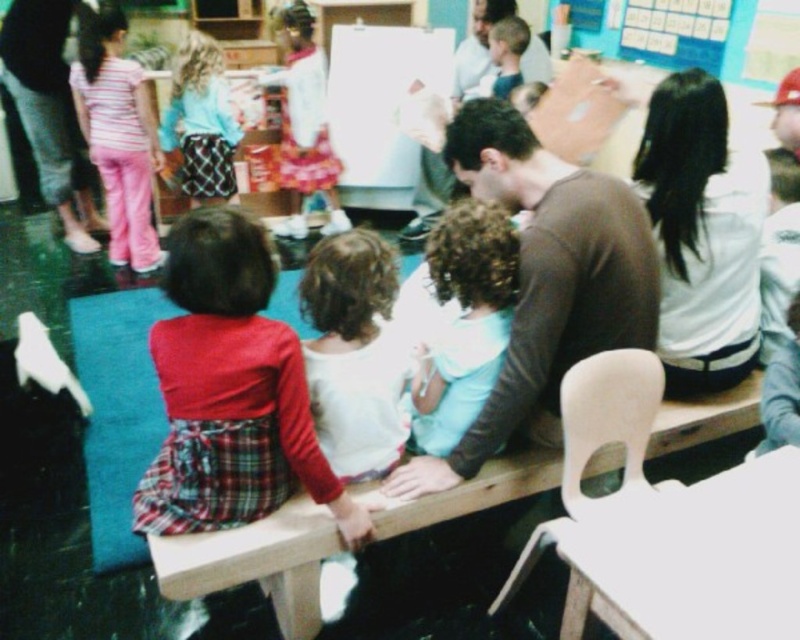
Can you confirm if brown long-sleeve shirt at center is bigger than matte pink pants at left?

No.

This screenshot has width=800, height=640. What do you see at coordinates (545, 280) in the screenshot?
I see `brown long-sleeve shirt at center` at bounding box center [545, 280].

Where is `brown long-sleeve shirt at center`? This screenshot has width=800, height=640. brown long-sleeve shirt at center is located at coordinates (545, 280).

Does matte pink pants at left appear on the right side of blue plaid skirt at center?

Incorrect, matte pink pants at left is not on the right side of blue plaid skirt at center.

Which is behind, point (84, 163) or point (198, 102)?

The point (84, 163) is more distant.

The width and height of the screenshot is (800, 640). I want to click on matte pink pants at left, so click(49, 112).

Who is lower down, white matte shirt at center or matte pink pants at left?

Positioned lower is white matte shirt at center.

Which is above, white matte shirt at center or matte pink pants at left?

matte pink pants at left

Which is in front, point (462, 218) or point (49, 173)?

Point (462, 218)

Find the location of `white matte shirt at center`. white matte shirt at center is located at coordinates (464, 321).